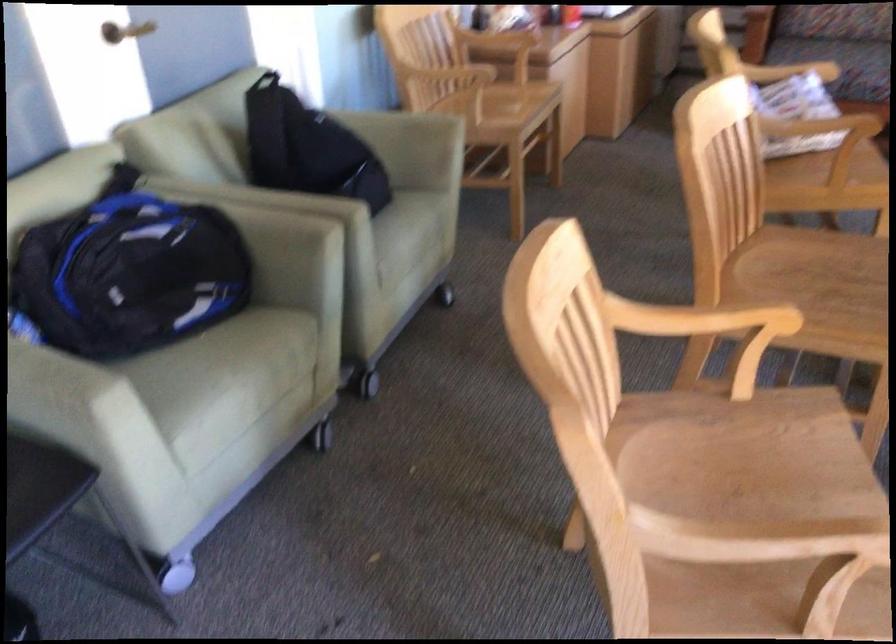
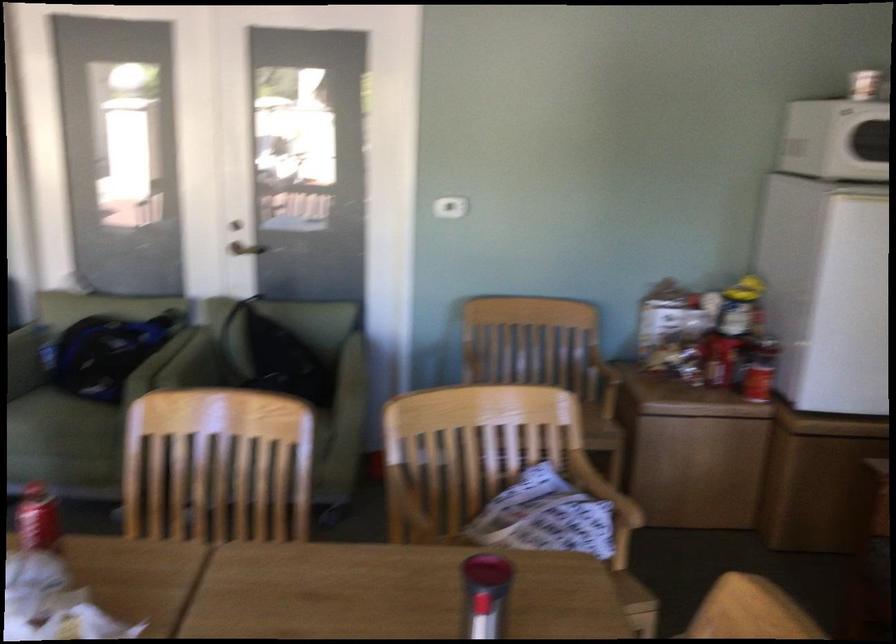
In the second image, find the point that corresponds to point (336, 136) in the first image.

(282, 359)